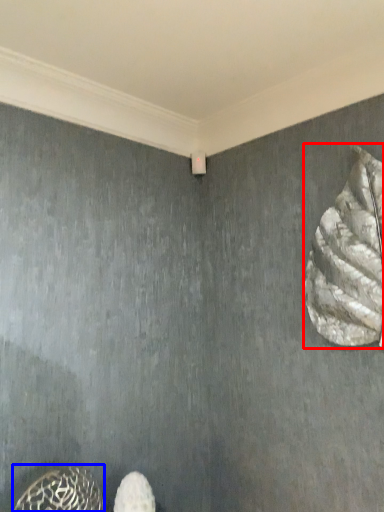
Question: Which object is closer to the camera taking this photo, animal (highlighted by a red box) or animal (highlighted by a blue box)?

Choices:
 (A) animal
 (B) animal

Answer: (B)